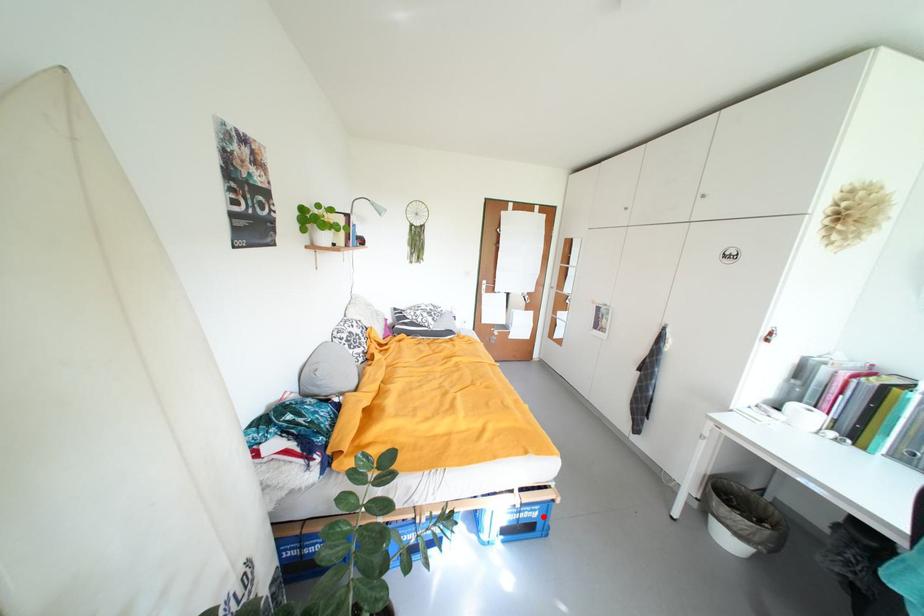
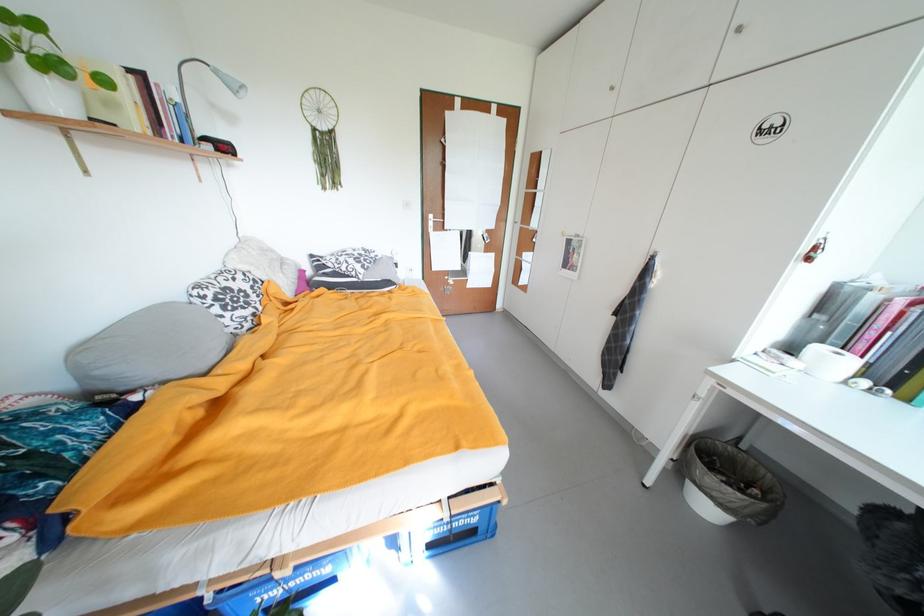
Locate, in the second image, the point that corresponds to the highlighted location in the first image.

(482, 522)